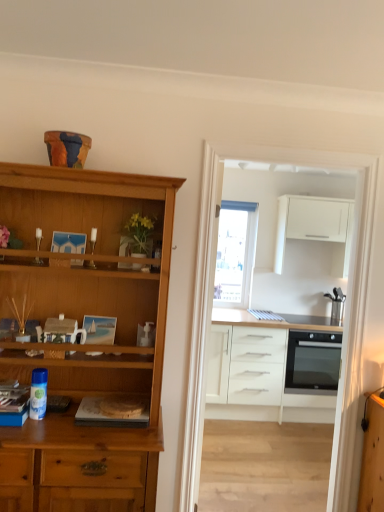
Question: From the image's perspective, is yellow artificial flowers in plastic at center positioned above or below white glossy cabinets at center?

Choices:
 (A) above
 (B) below

Answer: (A)

Question: Relative to white glossy cabinets at center, is yellow artificial flowers in plastic at center in front or behind?

Choices:
 (A) front
 (B) behind

Answer: (A)

Question: Estimate the real-world distances between objects in this image. Which object is closer to the transparent glass window at center?

Choices:
 (A) black glass oven at right
 (B) white matte cabinet at upper right, arranged as the 1th cabinetry when viewed from the top
 (C) white glossy cabinets at center
 (D) matte wooden picture frame at center
 (E) white matte cabinet at center, which is the 2th cabinetry in top-to-bottom order

Answer: (B)

Question: Considering the real-world distances, which object is farthest from the matte wooden picture frame at center?

Choices:
 (A) yellow artificial flowers in plastic at center
 (B) white matte cabinet at center, the 1th cabinetry positioned from the bottom
 (C) black glass oven at right
 (D) white glossy cabinets at center
 (E) white matte cabinet at upper right, acting as the second cabinetry starting from the bottom

Answer: (E)